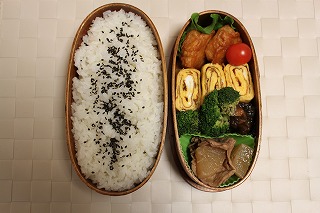
This screenshot has height=213, width=320. I want to click on mat, so click(x=20, y=141).